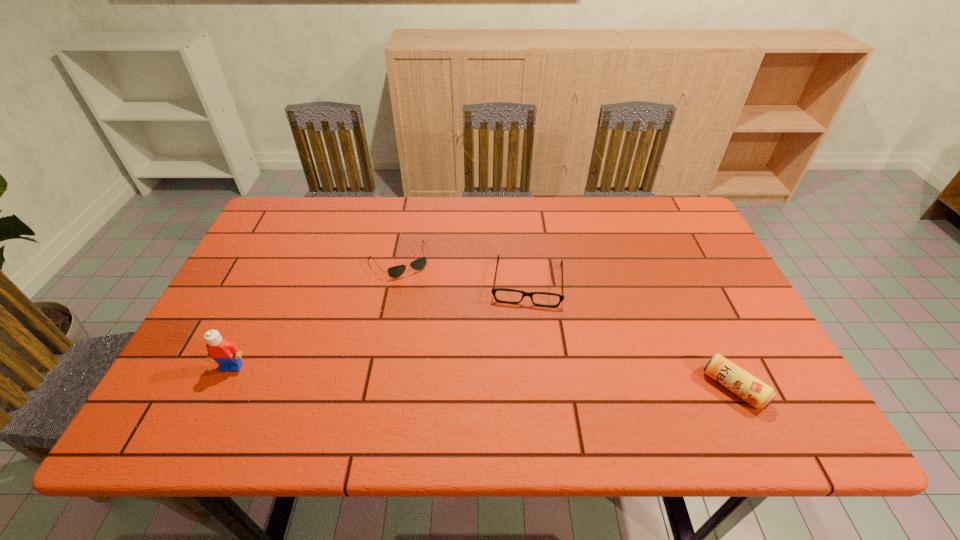
Where is `vacant space at the near edge`? This screenshot has width=960, height=540. vacant space at the near edge is located at coordinates (419, 396).

The image size is (960, 540). In the image, there is a desktop. In order to click on vacant space at the right edge in this screenshot , I will do `click(681, 316)`.

This screenshot has height=540, width=960. In order to click on vacant space at the near left corner of the desktop in this screenshot , I will do `click(211, 390)`.

Locate an element on the screen. vacant region at the far right corner of the desktop is located at coordinates (680, 222).

This screenshot has height=540, width=960. Identify the location of vacant space at the near right corner of the desktop. (770, 382).

The image size is (960, 540). Find the location of `free point between the beer can and the spectacles`. free point between the beer can and the spectacles is located at coordinates (631, 335).

At what (x,y) coordinates should I click in order to perform the action: click on empty space between the spectacles and the leftmost object. Please return your answer as a coordinate pair (x, y). Looking at the image, I should click on (380, 325).

In order to click on blank region between the tallest object and the spectacles in this screenshot , I will do `click(380, 325)`.

I want to click on free space between the sunglasses and the beer can, so click(566, 325).

The height and width of the screenshot is (540, 960). What are the coordinates of `empty space that is in between the Lego and the second object from right to left` in the screenshot? It's located at (380, 325).